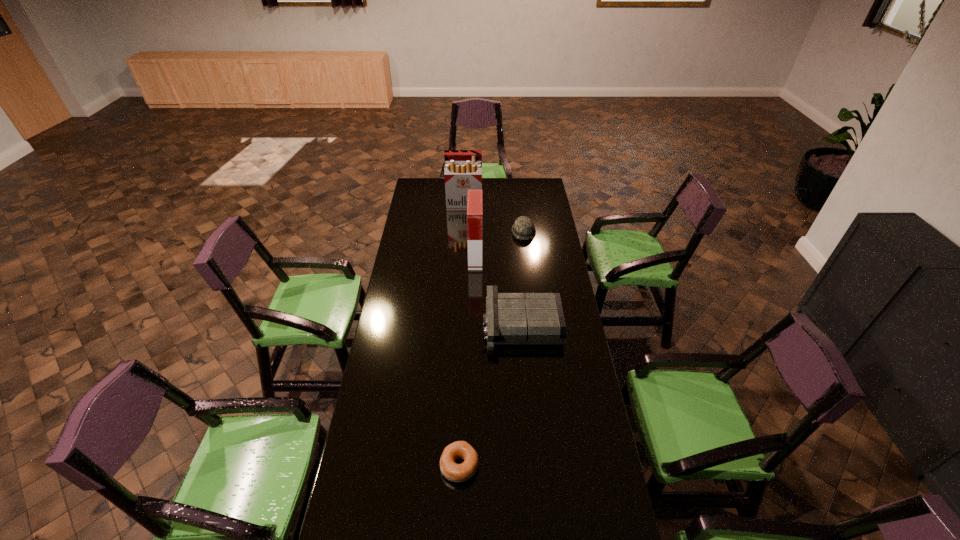
I want to click on free space between the farther cigarette_case and the second nearest object, so click(x=492, y=265).

Locate an element on the screen. The image size is (960, 540). free space between the radio receiver and the farthest object is located at coordinates (492, 265).

At what (x,y) coordinates should I click in order to perform the action: click on free space between the third nearest object and the second farthest object. Please return your answer as a coordinate pair (x, y). The height and width of the screenshot is (540, 960). Looking at the image, I should click on (499, 244).

Point out which object is positioned as the nearest to the farthest object. Please provide its 2D coordinates. Your answer should be formatted as a tuple, i.e. [(x, y)], where the tuple contains the x and y coordinates of a point satisfying the conditions above.

[(523, 228)]

Find the location of a particular element. This screenshot has height=540, width=960. the fourth closest object relative to the nearer cigarette_case is located at coordinates (453, 472).

I want to click on vacant space that satisfies the following two spatial constraints: 1. with the lid open on the farthest object; 2. on the left side of the headwear, so click(x=463, y=232).

Identify the location of vacant point that satisfies the following two spatial constraints: 1. with the lid open on the farther cigarette_case; 2. on the left side of the headwear. The image size is (960, 540). (463, 232).